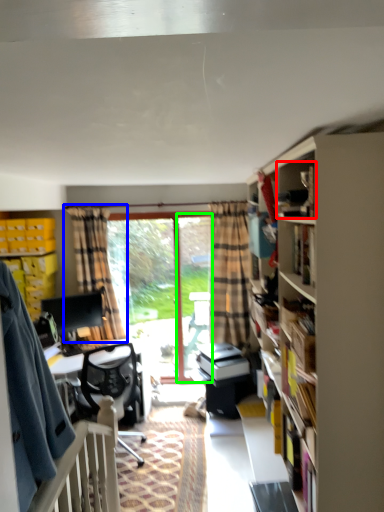
Question: Considering the real-world distances, which object is farthest from book (highlighted by a red box)? curtain (highlighted by a blue box) or screen door (highlighted by a green box)?

Choices:
 (A) curtain
 (B) screen door

Answer: (A)